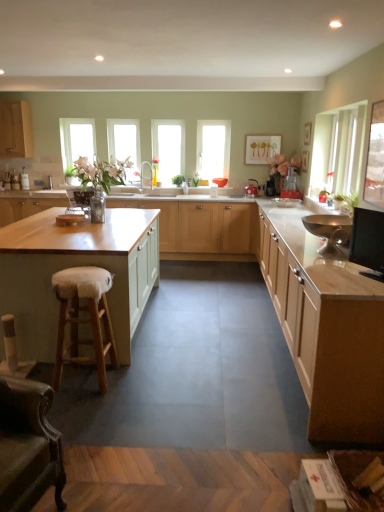
What is the approximate height of matte wood cabinet at upper left, arranged as the 5th cabinetry when ordered from the bottom?

The height of matte wood cabinet at upper left, arranged as the 5th cabinetry when ordered from the bottom, is 34.12 inches.

What is the approximate height of light wood cabinet at right, the 5th cabinetry viewed from the top?

It is 91.13 centimeters.

Locate an element on the screen. The height and width of the screenshot is (512, 384). clear glass window at center, the second window from the right is located at coordinates 168,148.

Considering the relative positions of clear glass window at center, the second window from the right, and wooden island at center, acting as the 4th cabinetry starting from the bottom, in the image provided, is clear glass window at center, the second window from the right, in front of wooden island at center, acting as the 4th cabinetry starting from the bottom,?

No, clear glass window at center, the second window from the right, is further to the viewer.

From the image's perspective, which cabinetry is the 1st one below the clear glass window at center, marked as the third window in a left-to-right arrangement? Please provide its 2D coordinates.

[(200, 225)]

How different are the orientations of clear glass window at center, the second window from the right, and wooden island at center, the second cabinetry viewed from the top, in degrees?

clear glass window at center, the second window from the right, and wooden island at center, the second cabinetry viewed from the top, are facing 0.491 degrees away from each other.

Is clear glass window at center, marked as the third window in a left-to-right arrangement, placed right next to clear glass window at left, placed as the 1th window when sorted from left to right?

No, clear glass window at center, marked as the third window in a left-to-right arrangement, is not beside clear glass window at left, placed as the 1th window when sorted from left to right.

Considering the sizes of objects clear glass window at center, marked as the third window in a left-to-right arrangement, and clear glass window at left, which appears as the 4th window when viewed from the right, in the image provided, who is thinner, clear glass window at center, marked as the third window in a left-to-right arrangement, or clear glass window at left, which appears as the 4th window when viewed from the right,?

With smaller width is clear glass window at left, which appears as the 4th window when viewed from the right.

Looking at this image, between clear glass window at center, the second window from the right, and clear glass window at left, which appears as the 4th window when viewed from the right, which one has smaller size?

clear glass window at left, which appears as the 4th window when viewed from the right.

Which window is the 2nd one when counting from the front of the clear glass window at left, which appears as the 4th window when viewed from the right? Please provide its 2D coordinates.

[(168, 148)]

Is clear glass window at center, the third window from the right, wider or thinner than matte wood cabinets at center, the 3th cabinetry in the bottom-to-top sequence?

In the image, clear glass window at center, the third window from the right, appears to be more narrow than matte wood cabinets at center, the 3th cabinetry in the bottom-to-top sequence.

Is clear glass window at center, which is the second window in left-to-right order, looking in the opposite direction of matte wood cabinets at center, which is the third cabinetry in top-to-bottom order?

clear glass window at center, which is the second window in left-to-right order, is not turned away from matte wood cabinets at center, which is the third cabinetry in top-to-bottom order.

Is clear glass window at center, which is the second window in left-to-right order, to the left of matte wood cabinets at center, the 3th cabinetry in the bottom-to-top sequence, from the viewer's perspective?

Yes.

Find the location of `the 4th window above the matte wood cabinets at center, the 3th cabinetry in the bottom-to-top sequence (from the image's perspective)`. the 4th window above the matte wood cabinets at center, the 3th cabinetry in the bottom-to-top sequence (from the image's perspective) is located at coordinates (125, 144).

Is clear glass window at center, which is the second window in left-to-right order, oriented towards white furry stool at lower left?

Yes, clear glass window at center, which is the second window in left-to-right order, faces towards white furry stool at lower left.

Would you say clear glass window at center, which is the second window in left-to-right order, is inside or outside white furry stool at lower left?

clear glass window at center, which is the second window in left-to-right order, is outside white furry stool at lower left.

Which is closer, (x=139, y=157) or (x=73, y=344)?

Point (x=139, y=157).

Is metallic red kettle at center, positioned as the 2th appliance in bottom-to-top order, to the left or to the right of clear glass window screen at upper right in the image?

Based on their positions, metallic red kettle at center, positioned as the 2th appliance in bottom-to-top order, is located to the left of clear glass window screen at upper right.

Is metallic red kettle at center, the second appliance in the back-to-front sequence, surrounding clear glass window screen at upper right?

No, clear glass window screen at upper right is not a part of metallic red kettle at center, the second appliance in the back-to-front sequence.

Which object is wider, metallic red kettle at center, the second appliance in the back-to-front sequence, or clear glass window screen at upper right?

metallic red kettle at center, the second appliance in the back-to-front sequence.

The height and width of the screenshot is (512, 384). Find the location of `window screen located on the right of metallic red kettle at center, positioned as the 2th appliance in bottom-to-top order`. window screen located on the right of metallic red kettle at center, positioned as the 2th appliance in bottom-to-top order is located at coordinates (375, 158).

From a real-world perspective, who is located higher, clear glass window at center, the third window from the right, or clear glass window at left, which appears as the 4th window when viewed from the right?

In real-world perspective, clear glass window at center, the third window from the right, is above.

Is clear glass window at center, the third window from the right, positioned far away from clear glass window at left, placed as the 1th window when sorted from left to right?

No, clear glass window at center, the third window from the right, is not far away from clear glass window at left, placed as the 1th window when sorted from left to right.

Looking at this image, considering the positions of objects clear glass window at center, which is the second window in left-to-right order, and clear glass window at left, which appears as the 4th window when viewed from the right, in the image provided, who is more to the left, clear glass window at center, which is the second window in left-to-right order, or clear glass window at left, which appears as the 4th window when viewed from the right,?

From the viewer's perspective, clear glass window at left, which appears as the 4th window when viewed from the right, appears more on the left side.

Who is taller, clear glass window screen at upper right or matte wood cabinet at upper left, arranged as the 5th cabinetry when ordered from the bottom?

Standing taller between the two is matte wood cabinet at upper left, arranged as the 5th cabinetry when ordered from the bottom.

Does clear glass window screen at upper right turn towards matte wood cabinet at upper left, positioned as the 1th cabinetry in top-to-bottom order?

No, clear glass window screen at upper right is not turned towards matte wood cabinet at upper left, positioned as the 1th cabinetry in top-to-bottom order.

Based on the photo, which is correct: clear glass window screen at upper right is inside matte wood cabinet at upper left, arranged as the 5th cabinetry when ordered from the bottom, or outside of it?

The correct answer is: outside.

How different are the orientations of clear glass window screen at upper right and matte wood cabinet at upper left, arranged as the 5th cabinetry when ordered from the bottom, in degrees?

clear glass window screen at upper right and matte wood cabinet at upper left, arranged as the 5th cabinetry when ordered from the bottom, are facing 179 degrees away from each other.

Find the location of a particular element. Image resolution: width=384 pixels, height=512 pixels. the 3rd cabinetry positioned below the clear glass window at center, marked as the third window in a left-to-right arrangement (from a real-world perspective) is located at coordinates (200, 225).

From the image's perspective, starting from the clear glass window at left, placed as the 1th window when sorted from left to right, which window is the 1st one below? Please provide its 2D coordinates.

[(168, 148)]

Considering their positions, is light wood cabinet at right, which is the 1th cabinetry from bottom to top, positioned further to metallic red kettle at center, the second appliance in the back-to-front sequence, than green leafy plant at center, acting as the second plant starting from the front?

Among the two, light wood cabinet at right, which is the 1th cabinetry from bottom to top, is located further to metallic red kettle at center, the second appliance in the back-to-front sequence.

Considering their positions, is light wood cabinet at right, which is the 1th cabinetry from bottom to top, positioned further to clear glass window at left, placed as the 1th window when sorted from left to right, than white furry stool at lower left?

Based on the image, light wood cabinet at right, which is the 1th cabinetry from bottom to top, appears to be further to clear glass window at left, placed as the 1th window when sorted from left to right.

Based on their spatial positions, is metallic silver toaster at center, marked as the third appliance in a front-to-back arrangement, or clear glass window at center, the third window from the right, closer to light wood cabinet at right, the 5th cabinetry viewed from the top?

metallic silver toaster at center, marked as the third appliance in a front-to-back arrangement, is positioned closer to the anchor light wood cabinet at right, the 5th cabinetry viewed from the top.

Based on their spatial positions, is light wood cabinet at right, the 5th cabinetry viewed from the top, or metallic silver toaster at center, marked as the third appliance in a front-to-back arrangement, further from clear glass window at center, acting as the 4th window starting from the left?

Among the two, light wood cabinet at right, the 5th cabinetry viewed from the top, is located further to clear glass window at center, acting as the 4th window starting from the left.

From the picture: Which object lies nearer to the anchor point matte wood cabinets at center, the 3th cabinetry in the bottom-to-top sequence, metallic silver toaster at center, which is the 1th appliance in top-to-bottom order, or metallic gold bowl at right, the first appliance when ordered from front to back?

Among the two, metallic gold bowl at right, the first appliance when ordered from front to back, is located nearer to matte wood cabinets at center, the 3th cabinetry in the bottom-to-top sequence.

Based on their spatial positions, is clear glass window at center, acting as the 4th window starting from the left, or green leafy plant at right, which is counted as the 1th plant, starting from the front, closer to metallic red kettle at center, which is the 2th appliance in top-to-bottom order?

clear glass window at center, acting as the 4th window starting from the left, is positioned closer to the anchor metallic red kettle at center, which is the 2th appliance in top-to-bottom order.

From the image, which object appears to be farther from green leafy plant at center, arranged as the 2th plant when ordered from the bottom, matte wood cabinets at center, the 3th cabinetry in the bottom-to-top sequence, or white furry stool at lower left?

white furry stool at lower left lies further to green leafy plant at center, arranged as the 2th plant when ordered from the bottom, than the other object.

Which object lies further to the anchor point clear glass window screen at upper right, white painted wood cabinet at center, which is the 4th cabinetry in top-to-bottom order, or metallic gold bowl at right, the first appliance when ordered from front to back?

white painted wood cabinet at center, which is the 4th cabinetry in top-to-bottom order, is further to clear glass window screen at upper right.

I want to click on plant between white furry stool at lower left and metallic silver toaster at center, marked as the third appliance in a front-to-back arrangement, from front to back, so click(346, 202).

At what (x,y) coordinates should I click in order to perform the action: click on window screen between white painted wood cabinet at center, positioned as the second cabinetry in bottom-to-top order, and green leafy plant at right, which ranks as the first plant in right-to-left order, in the horizontal direction. Please return your answer as a coordinate pair (x, y). Looking at the image, I should click on (375, 158).

Locate an element on the screen. The width and height of the screenshot is (384, 512). plant between light wood cabinet at right, the 5th cabinetry viewed from the top, and wooden island at center, acting as the 4th cabinetry starting from the bottom, in the front-back direction is located at coordinates (346, 202).

I want to click on plant between white furry stool at lower left and metallic red kettle at center, the second appliance in the back-to-front sequence, along the z-axis, so click(x=346, y=202).